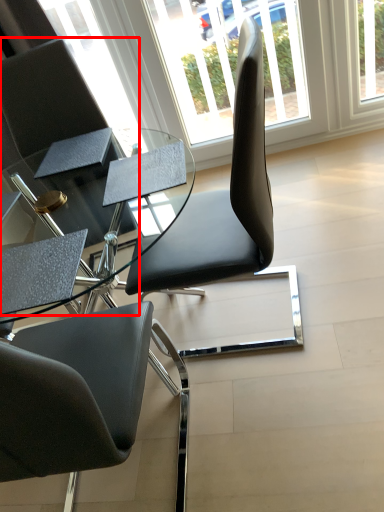
Question: Observing the image, what is the correct spatial positioning of chair (annotated by the red box) in reference to window?

Choices:
 (A) left
 (B) right

Answer: (A)